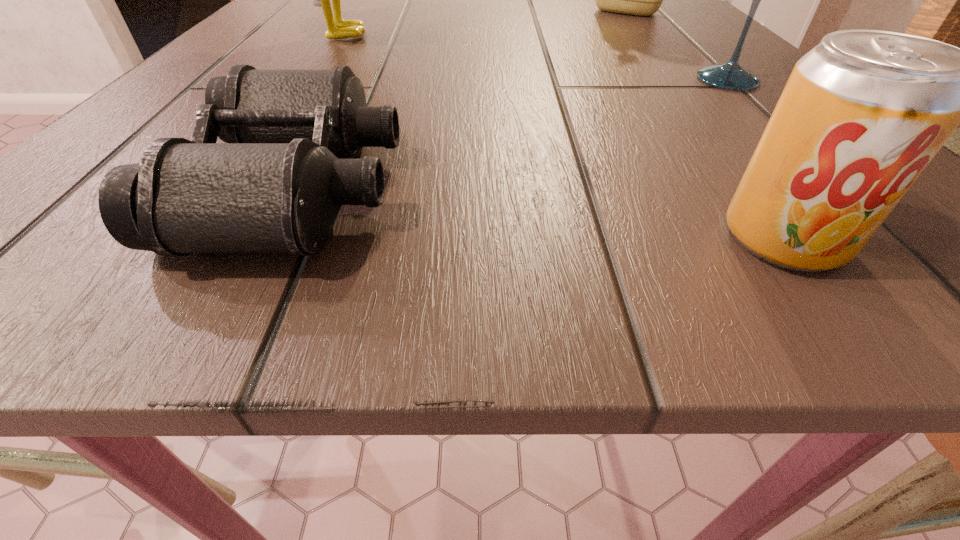
This screenshot has width=960, height=540. In order to click on free region located 0.300m through the eyepieces of the shortest object in this screenshot , I will do `click(715, 187)`.

Find the location of a particular element. This screenshot has width=960, height=540. gull positioned at the far edge is located at coordinates (337, 28).

Where is `detergent that is at the far edge`? The image size is (960, 540). detergent that is at the far edge is located at coordinates (641, 0).

The height and width of the screenshot is (540, 960). What are the coordinates of `pop (soda) situated at the near edge` in the screenshot? It's located at (863, 113).

You are a GUI agent. You are given a task and a screenshot of the screen. Output one action in this format:
    pyautogui.click(x=<x>, y=<y>)
    Task: Click on the binoculars at the near edge
    
    Given the screenshot: What is the action you would take?
    pyautogui.click(x=276, y=186)

Identify the location of gull present at the left edge. [337, 28].

This screenshot has height=540, width=960. Identify the location of binoculars that is at the left edge. (x=276, y=186).

Find the location of a particular element. detergent positioned at the right edge is located at coordinates pyautogui.click(x=641, y=0).

Find the location of `martini situated at the right edge`. martini situated at the right edge is located at coordinates (731, 76).

Locate an element on the screen. The height and width of the screenshot is (540, 960). pop (soda) at the right edge is located at coordinates (863, 113).